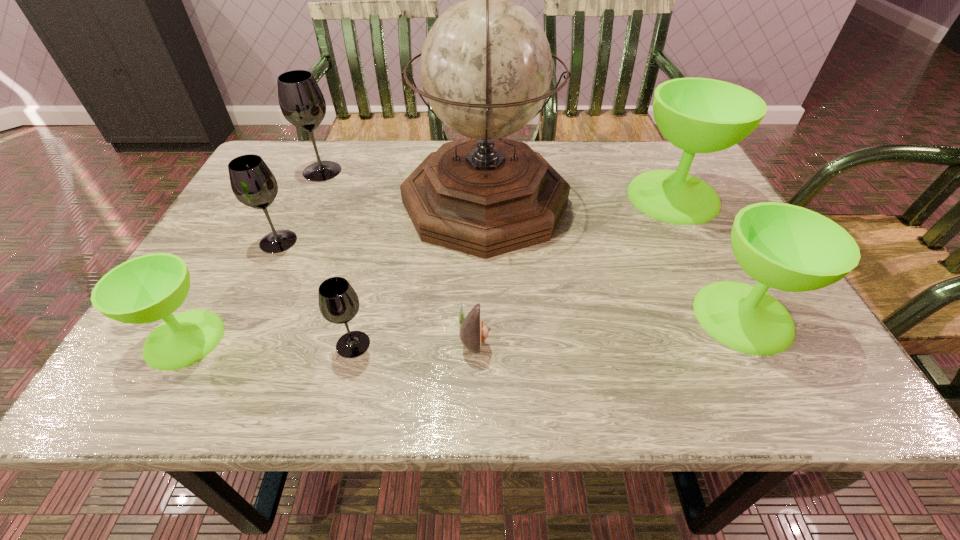
You are a GUI agent. You are given a task and a screenshot of the screen. Output one action in this format:
    pyautogui.click(x=<x>, y=<y>)
    Task: Click on the globe at the far edge
    The image size is (960, 540).
    Given the screenshot: What is the action you would take?
    pyautogui.click(x=486, y=66)

Image resolution: width=960 pixels, height=540 pixels. What are the coordinates of `avocado located at the near edge` in the screenshot? It's located at (473, 331).

Where is `object at the far left corner`? object at the far left corner is located at coordinates (301, 101).

Locate an element on the screen. object that is at the near left corner is located at coordinates (145, 289).

This screenshot has height=540, width=960. I want to click on object that is at the far right corner, so click(x=698, y=115).

You are a GUI agent. You are given a task and a screenshot of the screen. Output one action in this format:
    pyautogui.click(x=<x>, y=<y>)
    Task: Click on the free space at the far edge of the desktop
    The height and width of the screenshot is (540, 960).
    Given the screenshot: What is the action you would take?
    pyautogui.click(x=333, y=142)

Find the location of a particular element. The width and height of the screenshot is (960, 540). blank space at the near edge is located at coordinates (337, 378).

In the image, there is a desktop. At what (x,y) coordinates should I click in order to perform the action: click on vacant space at the left edge. Please return your answer as a coordinate pair (x, y). The width and height of the screenshot is (960, 540). Looking at the image, I should click on (199, 262).

The height and width of the screenshot is (540, 960). I want to click on free space at the near left corner, so click(x=203, y=364).

I want to click on free space between the farthest green wineglass and the avocado, so click(574, 267).